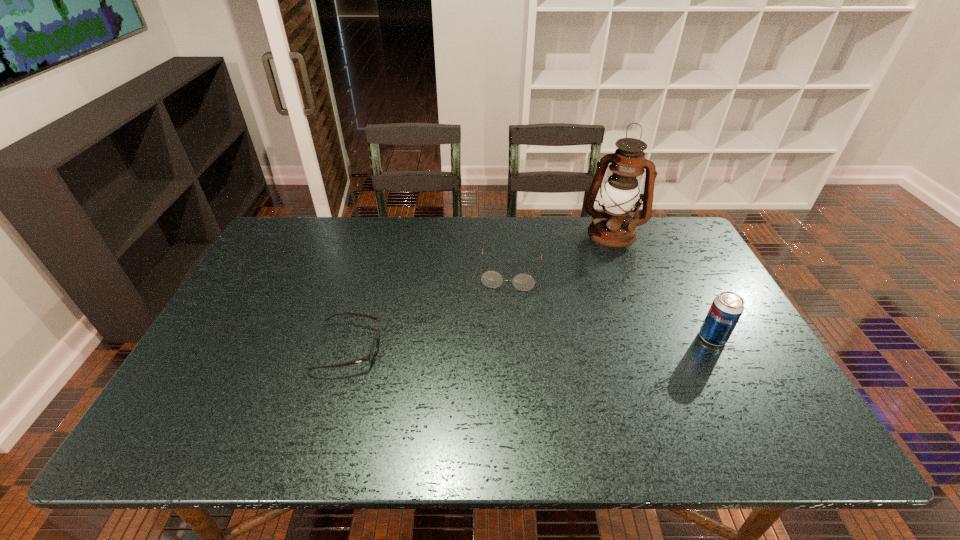
You are a GUI agent. You are given a task and a screenshot of the screen. Output one action in this format:
    pyautogui.click(x=<x>, y=<y>)
    Task: Click on the leftmost object
    
    Given the screenshot: What is the action you would take?
    pyautogui.click(x=370, y=356)

Image resolution: width=960 pixels, height=540 pixels. Identify the location of sunglasses. (370, 356).

At what (x,y) coordinates should I click in order to perform the action: click on the second tallest object. Please return your answer as a coordinate pair (x, y). Looking at the image, I should click on (726, 309).

This screenshot has width=960, height=540. In order to click on beer can in this screenshot , I will do `click(726, 309)`.

The height and width of the screenshot is (540, 960). I want to click on the second farthest object, so click(x=492, y=279).

Find the location of a particular element. the third tallest object is located at coordinates (492, 279).

The height and width of the screenshot is (540, 960). I want to click on the farthest object, so click(x=614, y=227).

Locate an element on the screen. The height and width of the screenshot is (540, 960). the tallest object is located at coordinates (614, 227).

Where is `vacant space located on the front-facing side of the leftmost object`? The height and width of the screenshot is (540, 960). vacant space located on the front-facing side of the leftmost object is located at coordinates (443, 347).

Where is `vacant space positioned on the back of the rightmost object`? Image resolution: width=960 pixels, height=540 pixels. vacant space positioned on the back of the rightmost object is located at coordinates pos(700,315).